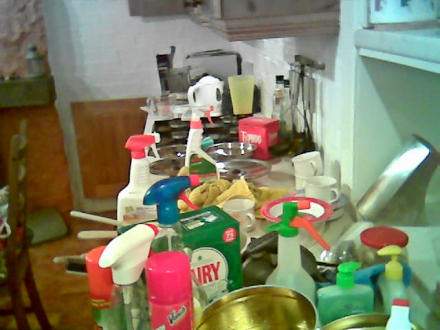
This screenshot has height=330, width=440. What are the coordinates of `shelf` in the screenshot? It's located at (360, 102).